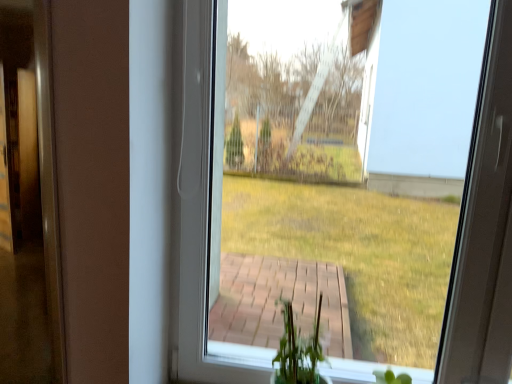
Locate an element on the screen. green matte plant at lower right is located at coordinates (391, 377).

Describe the element at coordinates (391, 377) in the screenshot. Image resolution: width=512 pixels, height=384 pixels. I see `green matte plant at lower right` at that location.

Locate an element on the screen. green matte plant at lower right is located at coordinates (391, 377).